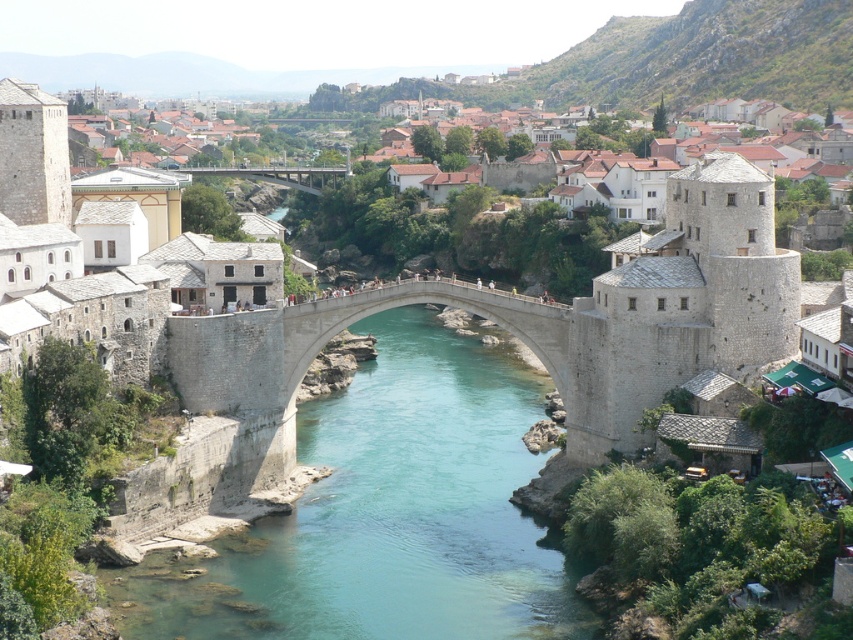
Question: Which point is farther from the camera taking this photo?

Choices:
 (A) (837, 172)
 (B) (451, 611)

Answer: (A)

Question: Among these objects, which one is nearest to the camera?

Choices:
 (A) clear blue water at center
 (B) concrete bridge at center

Answer: (A)

Question: Which point is farther to the camera?

Choices:
 (A) clear blue water at center
 (B) white stone tower at center
 (C) concrete bridge at center

Answer: (C)

Question: Can you confirm if clear blue water at center is positioned below concrete bridge at center?

Choices:
 (A) no
 (B) yes

Answer: (B)

Question: Can you confirm if clear blue water at center is positioned to the left of white stone tower at center?

Choices:
 (A) yes
 (B) no

Answer: (A)

Question: Does white stone tower at center have a greater width compared to concrete bridge at center?

Choices:
 (A) no
 (B) yes

Answer: (B)